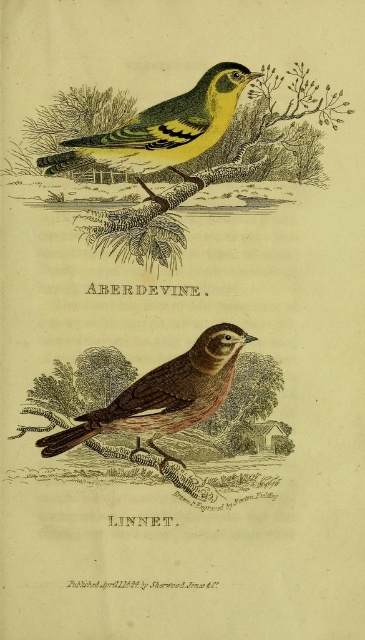
Question: Is green textured branch at upper center above yellow-green woodpecker at upper center?

Choices:
 (A) no
 (B) yes

Answer: (A)

Question: Estimate the real-world distances between objects in this image. Which object is closer to the yellow-green woodpecker at upper center?

Choices:
 (A) green textured branch at upper center
 (B) brown speckled bird at center

Answer: (A)

Question: Estimate the real-world distances between objects in this image. Which object is farther from the brown speckled bird at center?

Choices:
 (A) yellow-green woodpecker at upper center
 (B) green textured branch at upper center

Answer: (A)

Question: Is green textured branch at upper center thinner than yellow-green woodpecker at upper center?

Choices:
 (A) yes
 (B) no

Answer: (B)

Question: Which of the following is the farthest from the observer?

Choices:
 (A) yellow-green woodpecker at upper center
 (B) brown speckled bird at center
 (C) green textured branch at upper center

Answer: (C)

Question: Does green textured branch at upper center appear under yellow-green woodpecker at upper center?

Choices:
 (A) no
 (B) yes

Answer: (B)